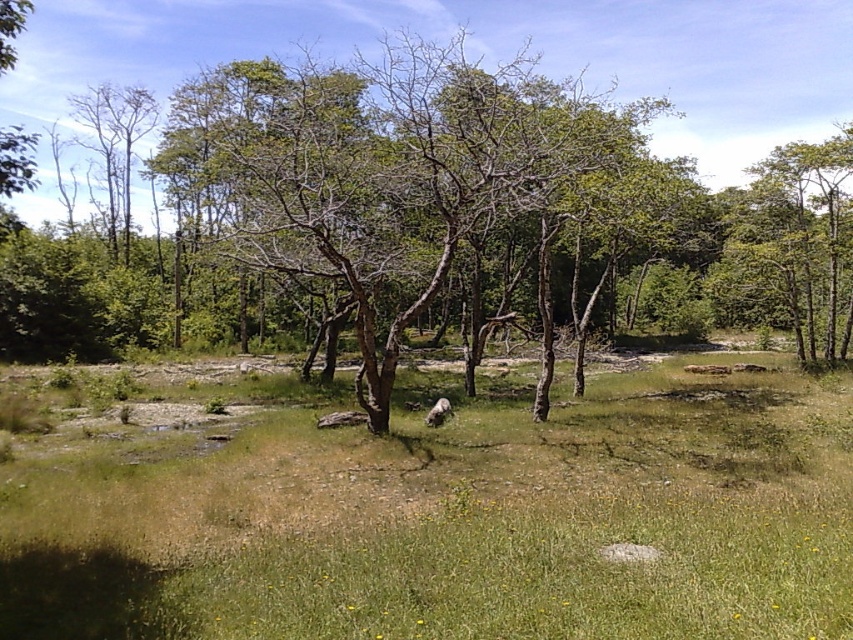
Question: Which point appears closest to the camera in this image?

Choices:
 (A) click(x=752, y=268)
 (B) click(x=650, y=397)

Answer: (B)

Question: Which of the following is the closest to the observer?

Choices:
 (A) green grass at center
 (B) green leafy tree at upper right

Answer: (A)

Question: Observing the image, what is the correct spatial positioning of green grass at center in reference to green leafy tree at upper right?

Choices:
 (A) above
 (B) below

Answer: (B)

Question: Is green grass at center to the right of green leafy tree at upper right from the viewer's perspective?

Choices:
 (A) no
 (B) yes

Answer: (A)

Question: Which is farther from the green grass at center?

Choices:
 (A) green leafy tree at upper right
 (B) brown wood tree at center

Answer: (B)

Question: Does green grass at center appear on the left side of brown wood tree at center?

Choices:
 (A) yes
 (B) no

Answer: (B)